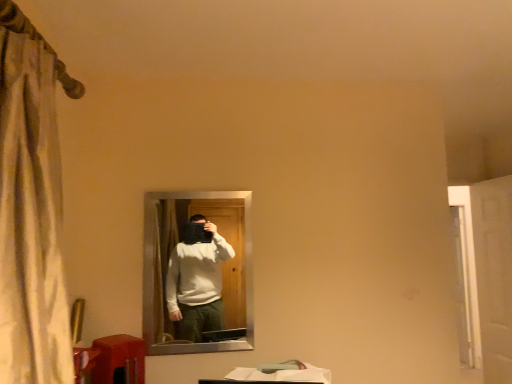
Question: From a real-world perspective, does matte black mirror at center stand above matte orange table at lower left?

Choices:
 (A) yes
 (B) no

Answer: (A)

Question: Considering the relative positions of matte black mirror at center and matte orange table at lower left in the image provided, is matte black mirror at center to the left of matte orange table at lower left from the viewer's perspective?

Choices:
 (A) no
 (B) yes

Answer: (A)

Question: Considering the relative sizes of matte black mirror at center and matte orange table at lower left in the image provided, is matte black mirror at center taller than matte orange table at lower left?

Choices:
 (A) yes
 (B) no

Answer: (A)

Question: Is matte black mirror at center oriented towards matte orange table at lower left?

Choices:
 (A) no
 (B) yes

Answer: (A)

Question: Is matte black mirror at center next to matte orange table at lower left?

Choices:
 (A) yes
 (B) no

Answer: (B)

Question: Does matte black mirror at center have a smaller size compared to matte orange table at lower left?

Choices:
 (A) no
 (B) yes

Answer: (A)

Question: Considering the relative sizes of matte orange table at lower left and white glossy door at right in the image provided, is matte orange table at lower left smaller than white glossy door at right?

Choices:
 (A) no
 (B) yes

Answer: (B)

Question: From the image's perspective, is matte orange table at lower left beneath white glossy door at right?

Choices:
 (A) yes
 (B) no

Answer: (A)

Question: Considering the relative sizes of matte orange table at lower left and white glossy door at right in the image provided, is matte orange table at lower left thinner than white glossy door at right?

Choices:
 (A) yes
 (B) no

Answer: (B)

Question: Considering the relative positions of matte orange table at lower left and white glossy door at right in the image provided, is matte orange table at lower left behind white glossy door at right?

Choices:
 (A) yes
 (B) no

Answer: (B)

Question: Is matte orange table at lower left positioned beyond the bounds of white glossy door at right?

Choices:
 (A) yes
 (B) no

Answer: (A)

Question: Can you confirm if matte orange table at lower left is bigger than white glossy door at right?

Choices:
 (A) yes
 (B) no

Answer: (B)

Question: Does white glossy door at right have a lesser width compared to matte black mirror at center?

Choices:
 (A) yes
 (B) no

Answer: (B)